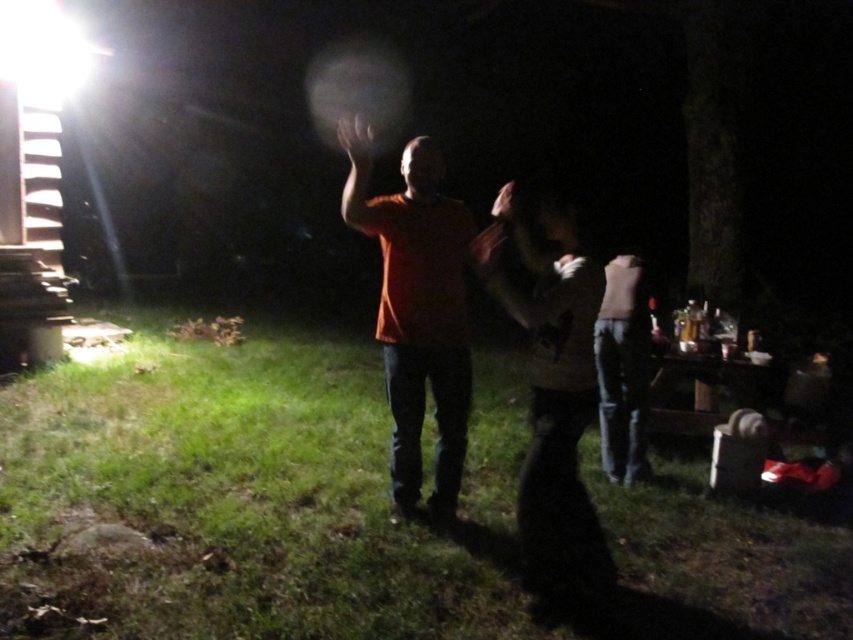
Question: Can you confirm if orange matte shirt at center is positioned to the right of matte brown sweater at center?

Choices:
 (A) no
 (B) yes

Answer: (A)

Question: Can you confirm if orange matte shirt at center is positioned above matte brown sweater at center?

Choices:
 (A) yes
 (B) no

Answer: (A)

Question: Observing the image, what is the correct spatial positioning of orange matte shirt at center in reference to matte brown sweater at center?

Choices:
 (A) above
 (B) below

Answer: (A)

Question: Which of the following is the closest to the observer?

Choices:
 (A) matte brown sweater at center
 (B) orange matte shirt at center

Answer: (B)